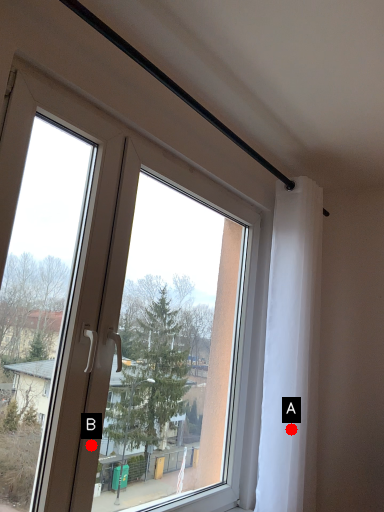
Question: Two points are circled on the image, labeled by A and B beside each circle. Among these points, which one is farthest from the camera?

Choices:
 (A) A is further
 (B) B is further

Answer: (A)